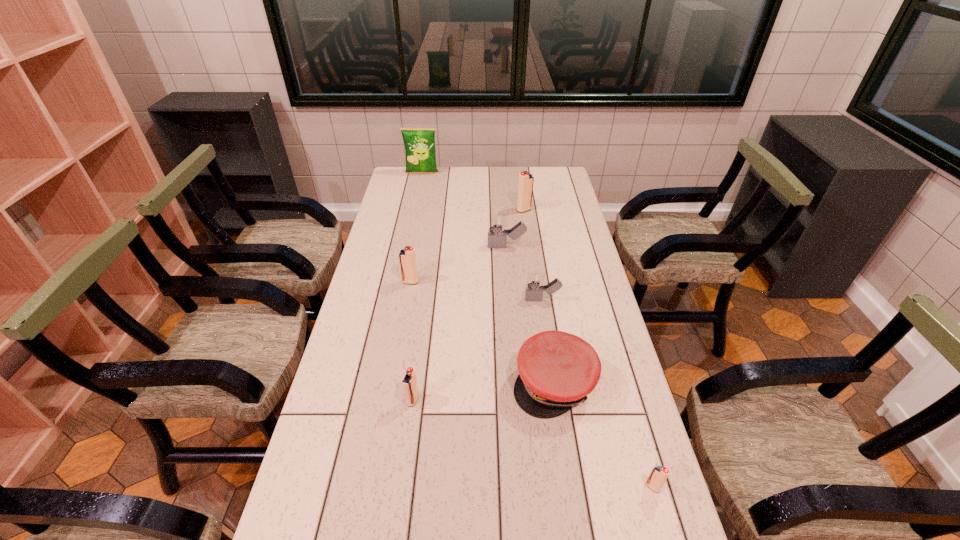
I want to click on vacant area situated 0.320m on the back of the third nearest igniter, so click(x=424, y=308).

The width and height of the screenshot is (960, 540). I want to click on free space located on the front-facing side of the red cap, so 564,449.

You are a GUI agent. You are given a task and a screenshot of the screen. Output one action in this format:
    pyautogui.click(x=<x>, y=<y>)
    Task: Click on the vacant space located 0.180m on the left of the rightmost igniter
    The width and height of the screenshot is (960, 540).
    Given the screenshot: What is the action you would take?
    pyautogui.click(x=566, y=487)

This screenshot has height=540, width=960. Identify the location of object present at the far edge. (419, 143).

Image resolution: width=960 pixels, height=540 pixels. I want to click on crisp (potato chip) at the left edge, so tap(419, 143).

The width and height of the screenshot is (960, 540). I want to click on igniter positioned at the left edge, so click(407, 259).

The image size is (960, 540). Identify the location of cap at the right edge. (557, 370).

This screenshot has width=960, height=540. In order to click on object located in the far left corner section of the desktop in this screenshot , I will do `click(419, 143)`.

The width and height of the screenshot is (960, 540). In the image, there is a desktop. Find the location of `free space at the far edge`. free space at the far edge is located at coordinates point(432,188).

Identify the location of free spot at the left edge of the desktop. Image resolution: width=960 pixels, height=540 pixels. (385, 208).